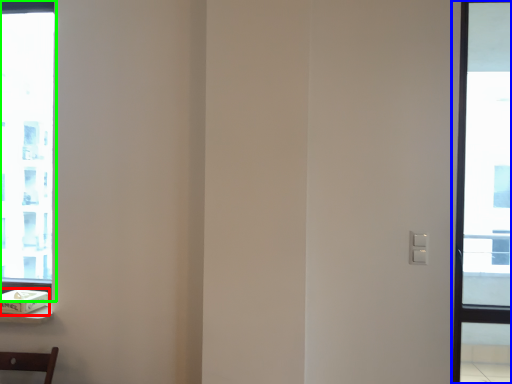
Question: Which is farther away from box (highlighted by a red box)? window (highlighted by a blue box) or window (highlighted by a green box)?

Choices:
 (A) window
 (B) window

Answer: (A)